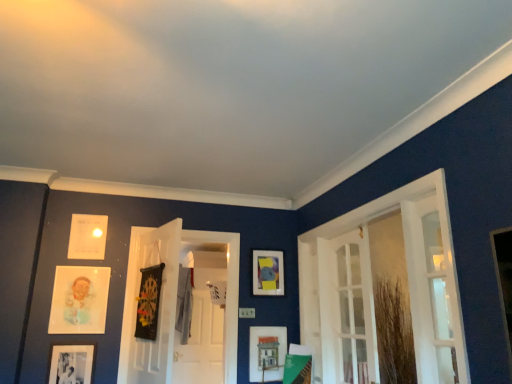
Question: Does black matte dartboard at center, the third picture frame viewed from the right, appear on the left side of matte paper portrait at left, the second picture frame viewed from the left?

Choices:
 (A) yes
 (B) no

Answer: (B)

Question: Does black matte dartboard at center, the third picture frame viewed from the right, have a lesser height compared to matte paper portrait at left, which is the 5th picture frame from right to left?

Choices:
 (A) yes
 (B) no

Answer: (B)

Question: Is black matte dartboard at center, the fourth picture frame from the left, wider than matte paper portrait at left, the second picture frame viewed from the left?

Choices:
 (A) yes
 (B) no

Answer: (A)

Question: Considering the relative positions of black matte dartboard at center, the fourth picture frame from the left, and matte paper portrait at left, which is the 5th picture frame from right to left, in the image provided, is black matte dartboard at center, the fourth picture frame from the left, to the right of matte paper portrait at left, which is the 5th picture frame from right to left, from the viewer's perspective?

Choices:
 (A) yes
 (B) no

Answer: (A)

Question: Is black matte dartboard at center, the fourth picture frame from the left, bigger than matte paper portrait at left, which is the 5th picture frame from right to left?

Choices:
 (A) yes
 (B) no

Answer: (A)

Question: From the image's perspective, is white paper at upper left, the 3th picture frame when ordered from left to right, located above or below white glass door at right, which is the third door in left-to-right order?

Choices:
 (A) below
 (B) above

Answer: (B)

Question: Is white paper at upper left, the 3th picture frame when ordered from left to right, spatially inside white glass door at right, which appears as the first door when viewed from the right, or outside of it?

Choices:
 (A) inside
 (B) outside

Answer: (B)

Question: Is point (75, 233) closer or farther from the camera than point (418, 216)?

Choices:
 (A) closer
 (B) farther

Answer: (B)

Question: Considering the positions of white paper at upper left, the 4th picture frame in the right-to-left sequence, and white glass door at right, which appears as the first door when viewed from the right, in the image, is white paper at upper left, the 4th picture frame in the right-to-left sequence, taller or shorter than white glass door at right, which appears as the first door when viewed from the right,?

Choices:
 (A) tall
 (B) short

Answer: (B)

Question: Considering the positions of point (356, 249) and point (154, 329), is point (356, 249) closer or farther from the camera than point (154, 329)?

Choices:
 (A) farther
 (B) closer

Answer: (A)

Question: From their relative heights in the image, would you say white glass door at right, the 2th door from the left, is taller or shorter than black matte dartboard at center, the third picture frame viewed from the right?

Choices:
 (A) short
 (B) tall

Answer: (B)

Question: Is white glass door at right, the second door when ordered from right to left, spatially inside black matte dartboard at center, the third picture frame viewed from the right, or outside of it?

Choices:
 (A) outside
 (B) inside

Answer: (A)

Question: Looking at their shapes, would you say white glass door at right, the 2th door from the left, is wider or thinner than black matte dartboard at center, the fourth picture frame from the left?

Choices:
 (A) thin
 (B) wide

Answer: (A)

Question: Does point (258, 342) appear closer or farther from the camera than point (129, 339)?

Choices:
 (A) farther
 (B) closer

Answer: (A)

Question: Based on their sizes in the image, would you say matte wooden picture frame at lower center, positioned as the 1th picture frame in right-to-left order, is bigger or smaller than black glossy dartboard at center, which is the 3th door in right-to-left order?

Choices:
 (A) small
 (B) big

Answer: (A)